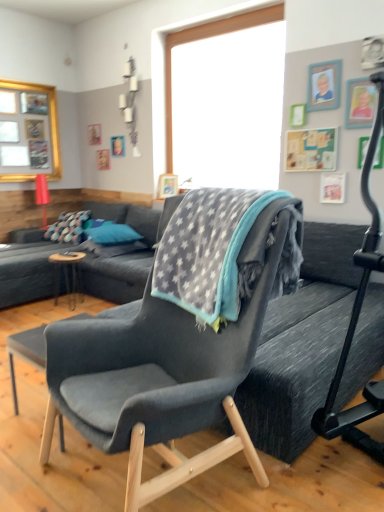
Question: From the image's perspective, would you say gray fleece blanket at center is shown under black rubber baby carriage at right?

Choices:
 (A) no
 (B) yes

Answer: (A)

Question: Does gray fleece blanket at center have a lesser height compared to black rubber baby carriage at right?

Choices:
 (A) yes
 (B) no

Answer: (A)

Question: Considering the relative positions of gray fleece blanket at center and black rubber baby carriage at right in the image provided, is gray fleece blanket at center behind black rubber baby carriage at right?

Choices:
 (A) no
 (B) yes

Answer: (B)

Question: Is gray fleece blanket at center smaller than black rubber baby carriage at right?

Choices:
 (A) yes
 (B) no

Answer: (A)

Question: Is gray fleece blanket at center oriented away from black rubber baby carriage at right?

Choices:
 (A) no
 (B) yes

Answer: (A)

Question: In terms of size, does blue fabric pillow at center appear bigger or smaller than black rubber baby carriage at right?

Choices:
 (A) big
 (B) small

Answer: (B)

Question: From a real-world perspective, is blue fabric pillow at center physically located above or below black rubber baby carriage at right?

Choices:
 (A) above
 (B) below

Answer: (B)

Question: Considering the positions of blue fabric pillow at center and black rubber baby carriage at right in the image, is blue fabric pillow at center wider or thinner than black rubber baby carriage at right?

Choices:
 (A) thin
 (B) wide

Answer: (A)

Question: Is blue fabric pillow at center taller or shorter than black rubber baby carriage at right?

Choices:
 (A) short
 (B) tall

Answer: (A)

Question: Is gray fleece blanket at center inside the boundaries of gold-framed picture at upper left, or outside?

Choices:
 (A) outside
 (B) inside

Answer: (A)

Question: From the image's perspective, relative to gold-framed picture at upper left, is gray fleece blanket at center above or below?

Choices:
 (A) below
 (B) above

Answer: (A)

Question: Looking at their shapes, would you say gray fleece blanket at center is wider or thinner than gold-framed picture at upper left?

Choices:
 (A) thin
 (B) wide

Answer: (B)

Question: In terms of height, does gray fleece blanket at center look taller or shorter compared to gold-framed picture at upper left?

Choices:
 (A) tall
 (B) short

Answer: (B)

Question: Is gray fleece blanket at center inside the boundaries of brown wooden table at center, or outside?

Choices:
 (A) inside
 (B) outside

Answer: (B)

Question: Does point (261, 190) appear closer or farther from the camera than point (69, 309)?

Choices:
 (A) closer
 (B) farther

Answer: (A)